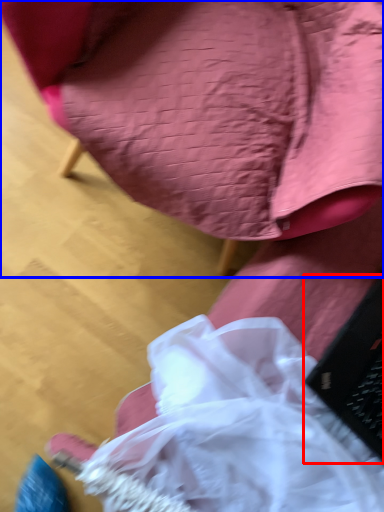
Question: Which object appears farthest to the camera in this image, laptop (highlighted by a red box) or chair (highlighted by a blue box)?

Choices:
 (A) laptop
 (B) chair

Answer: (A)